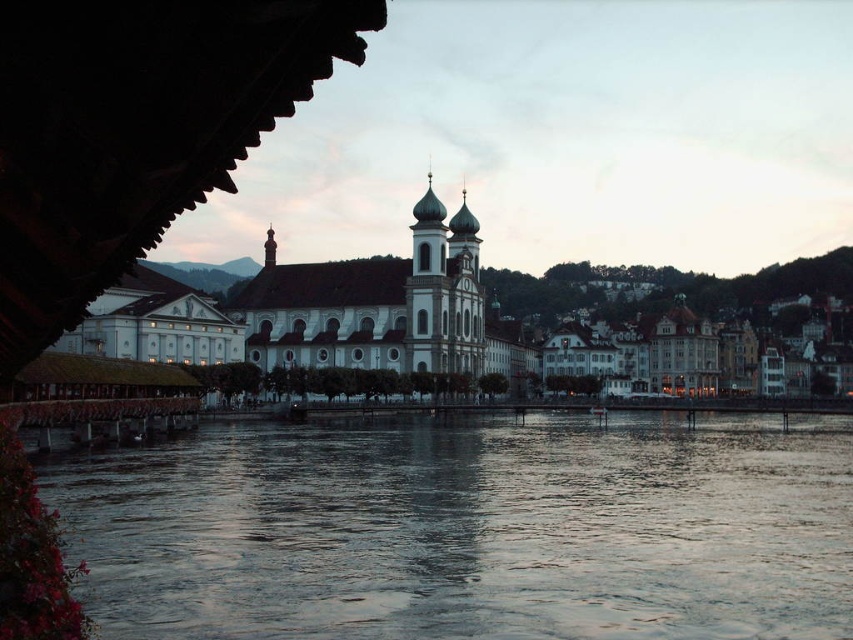
Who is higher up, dark water at center or white stone church at center?

Positioned higher is white stone church at center.

Is point (495, 568) closer to viewer compared to point (285, 353)?

Yes.

Locate an element on the screen. The height and width of the screenshot is (640, 853). dark water at center is located at coordinates (468, 529).

This screenshot has height=640, width=853. I want to click on dark water at center, so click(x=468, y=529).